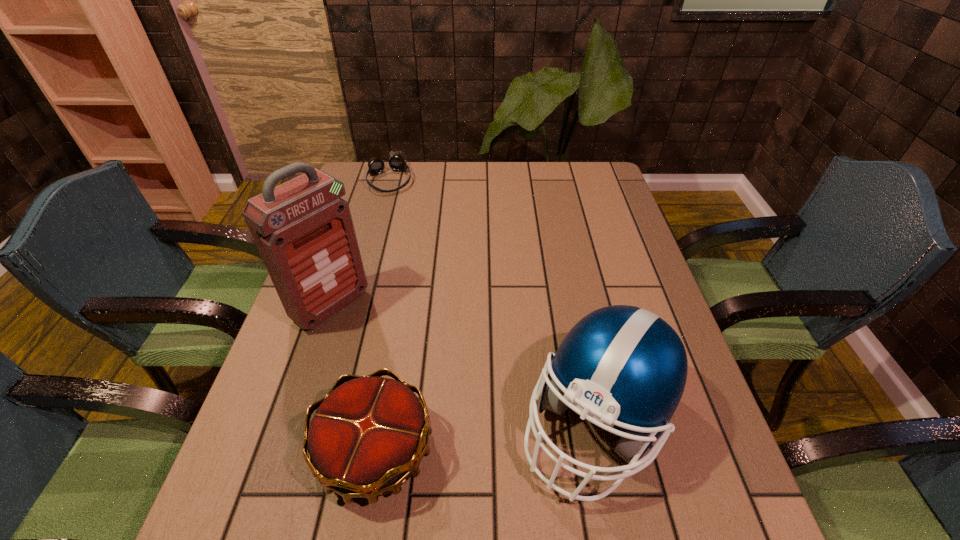
Identify the location of the second shortest object. The height and width of the screenshot is (540, 960). (366, 439).

The width and height of the screenshot is (960, 540). What are the coordinates of `the rightmost object` in the screenshot? It's located at (623, 366).

Where is `the third shortest object`? Image resolution: width=960 pixels, height=540 pixels. the third shortest object is located at coordinates (623, 366).

The image size is (960, 540). I want to click on goggles, so click(x=396, y=161).

The width and height of the screenshot is (960, 540). I want to click on the shortest object, so click(x=396, y=161).

Find the location of `the tallest object`. the tallest object is located at coordinates (304, 232).

At what (x,y) coordinates should I click in order to perform the action: click on the first-aid kit. Please return your answer as a coordinate pair (x, y). Looking at the image, I should click on (304, 232).

I want to click on blank area located 0.400m on the back of the crown, so click(x=407, y=269).

Find the location of a particular element. vacant space located through the lenses of the goggles is located at coordinates (407, 248).

You are a GUI agent. You are given a task and a screenshot of the screen. Output one action in this format:
    pyautogui.click(x=<x>, y=<y>)
    Task: Click on the free space located through the lenses of the goggles
    
    Given the screenshot: What is the action you would take?
    pyautogui.click(x=406, y=245)